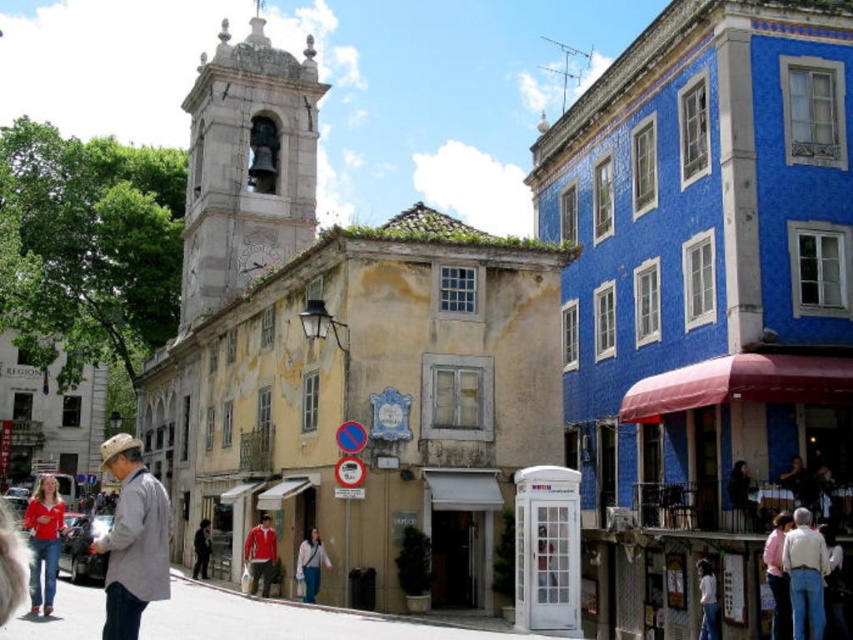
Can you confirm if gray cotton jacket at lower left is positioned to the left of dark gray jacket at lower left?

Indeed, gray cotton jacket at lower left is positioned on the left side of dark gray jacket at lower left.

Can you confirm if gray cotton jacket at lower left is shorter than dark gray jacket at lower left?

Incorrect, gray cotton jacket at lower left's height does not fall short of dark gray jacket at lower left's.

Does point (167, 497) come behind point (202, 572)?

No, (167, 497) is closer to viewer.

In order to click on gray cotton jacket at lower left in this screenshot , I will do `click(132, 540)`.

Does dark brown leather jacket at lower right have a greater height compared to dark gray jacket at lower left?

Correct, dark brown leather jacket at lower right is much taller as dark gray jacket at lower left.

Is dark brown leather jacket at lower right smaller than dark gray jacket at lower left?

Actually, dark brown leather jacket at lower right might be larger than dark gray jacket at lower left.

Which is behind, point (733, 492) or point (206, 573)?

The point (206, 573) is behind.

Image resolution: width=853 pixels, height=640 pixels. Find the location of `dark brown leather jacket at lower right`. dark brown leather jacket at lower right is located at coordinates (743, 496).

Is light beige sweater at center taller than white cotton shirt at lower right?

Yes, light beige sweater at center is taller than white cotton shirt at lower right.

Where is `light beige sweater at center`? light beige sweater at center is located at coordinates (310, 564).

Where is `light beige sweater at center`? The width and height of the screenshot is (853, 640). light beige sweater at center is located at coordinates (310, 564).